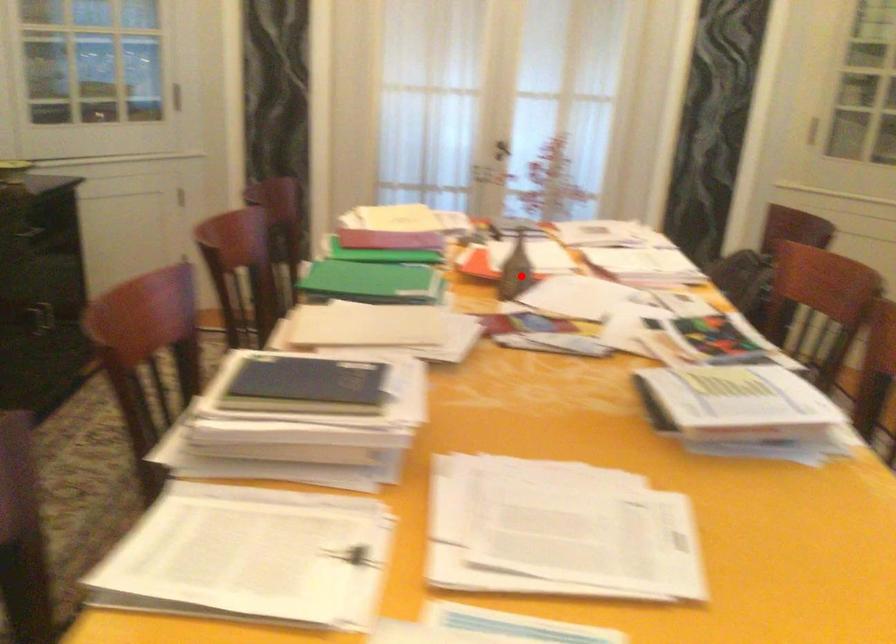
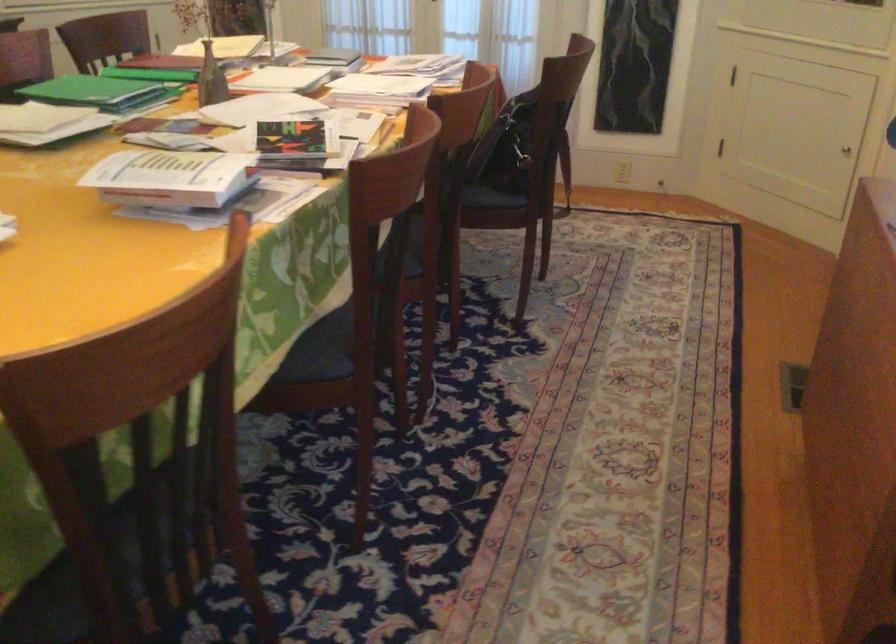
Where in the second image is the point corresponding to the highlighted location from the first image?

(211, 79)